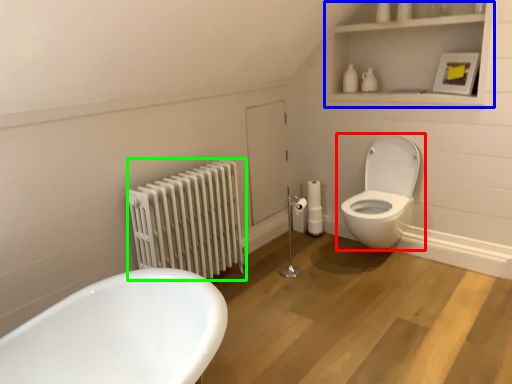
Question: Considering the real-world distances, which object is farthest from toilet (highlighted by a red box)? medicine cabinet (highlighted by a blue box) or radiator (highlighted by a green box)?

Choices:
 (A) medicine cabinet
 (B) radiator

Answer: (B)